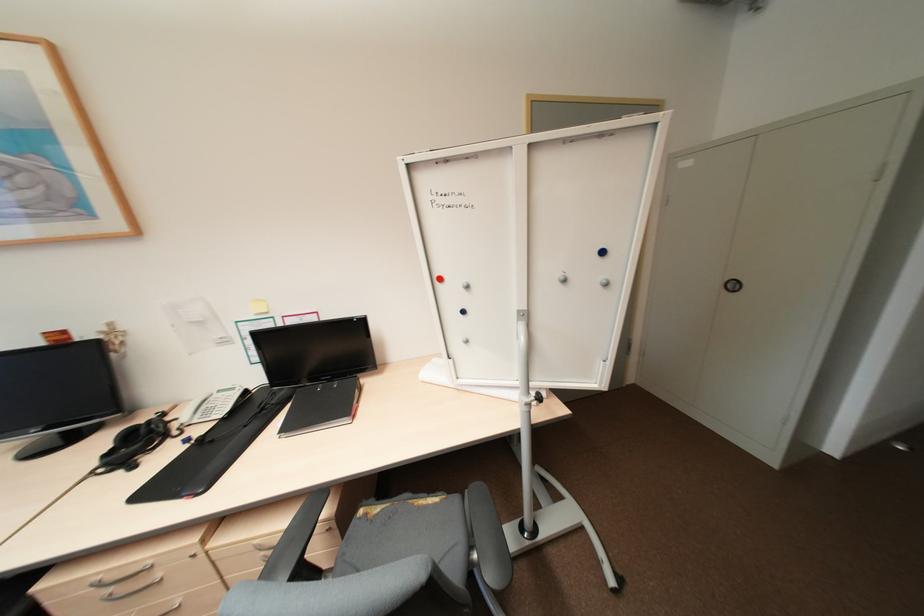
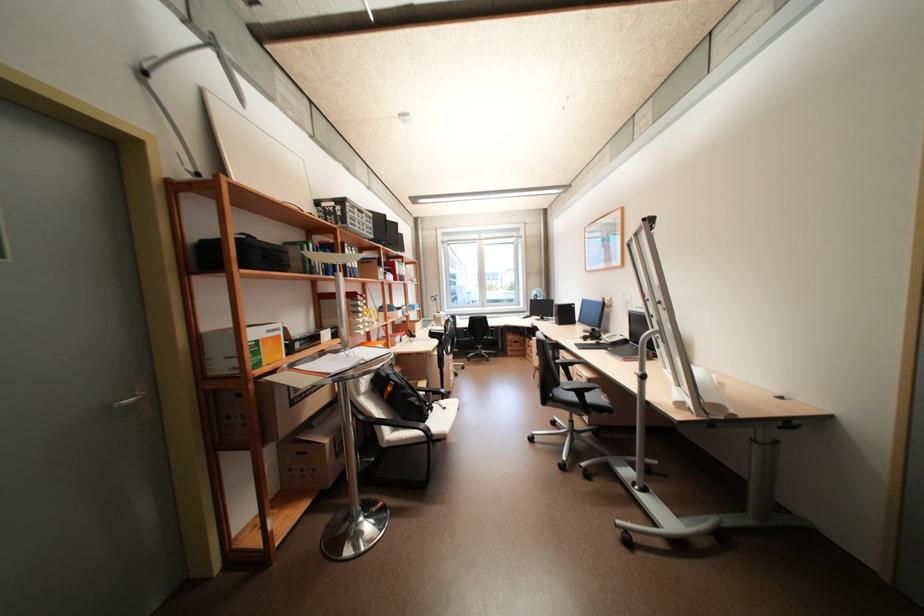
Where in the second image is the point corresponding to (x=192, y=440) from the first image?

(603, 342)